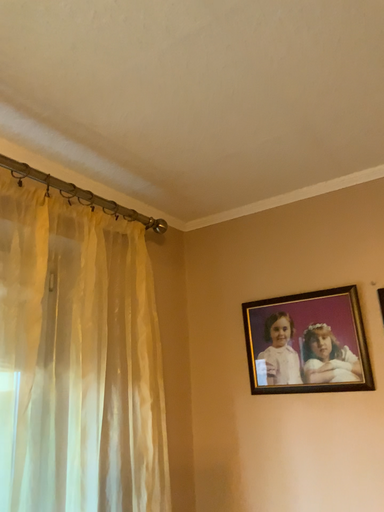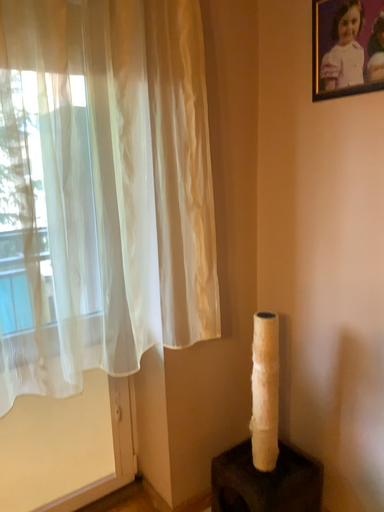
Question: Which way did the camera rotate in the video?

Choices:
 (A) rotated left
 (B) rotated right

Answer: (A)